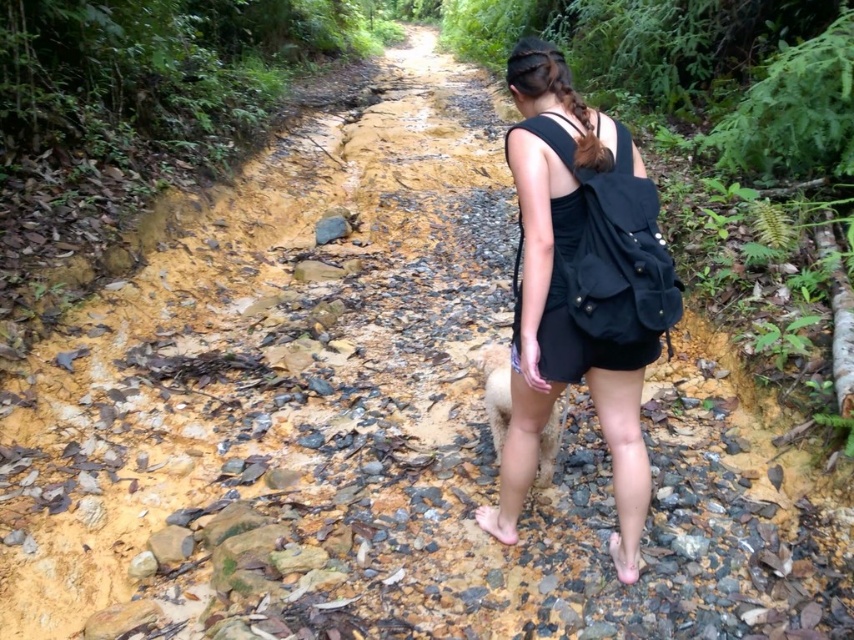
Question: Where is black fabric backpack at center located in relation to pink fabric sandal at lower center in the image?

Choices:
 (A) right
 (B) left

Answer: (B)

Question: Which object is farther from the camera taking this photo?

Choices:
 (A) black fabric backpack at center
 (B) pink fabric sandal at lower center

Answer: (B)

Question: Which object is closer to the camera taking this photo?

Choices:
 (A) pink fabric sandal at lower center
 (B) black fabric backpack at center

Answer: (B)

Question: Does black fabric backpack at center appear under pink fabric sandal at lower center?

Choices:
 (A) yes
 (B) no

Answer: (B)

Question: Considering the relative positions of black fabric backpack at center and pink fabric sandal at lower center in the image provided, where is black fabric backpack at center located with respect to pink fabric sandal at lower center?

Choices:
 (A) right
 (B) left

Answer: (B)